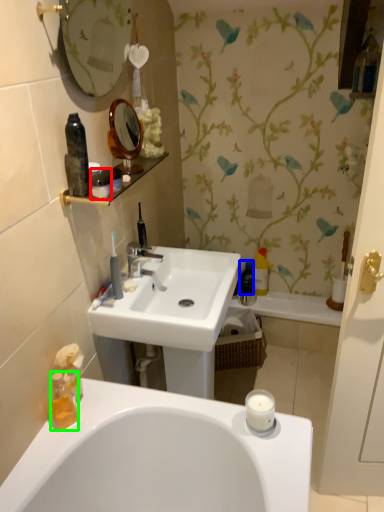
Question: Considering the real-world distances, which object is farthest from toiletry (highlighted by a red box)? bottle (highlighted by a blue box) or bottle (highlighted by a green box)?

Choices:
 (A) bottle
 (B) bottle

Answer: (A)